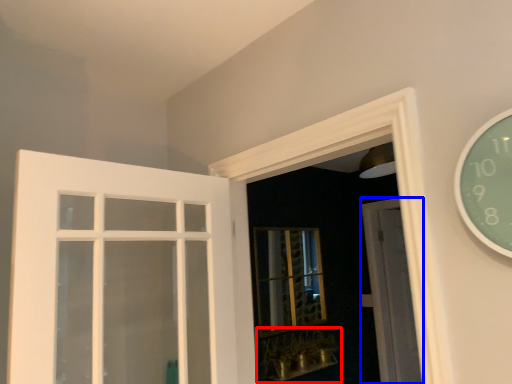
Question: Which object appears closest to the camera in this image, window sill (highlighted by a red box) or door (highlighted by a blue box)?

Choices:
 (A) window sill
 (B) door

Answer: (A)